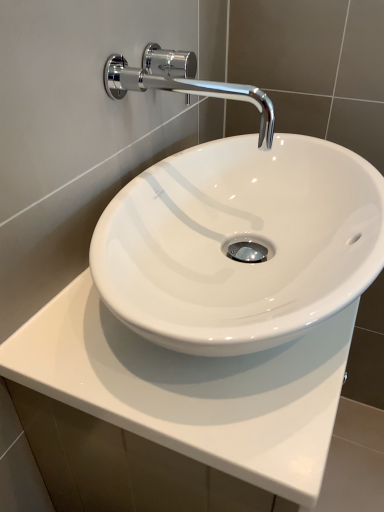
Question: Choose the correct answer: Is white glossy countertop at center inside chrome/metallic faucet at upper center or outside it?

Choices:
 (A) outside
 (B) inside

Answer: (A)

Question: Considering the positions of white glossy countertop at center and chrome/metallic faucet at upper center in the image, is white glossy countertop at center bigger or smaller than chrome/metallic faucet at upper center?

Choices:
 (A) big
 (B) small

Answer: (A)

Question: Would you say white glossy countertop at center is to the left or to the right of chrome/metallic faucet at upper center in the picture?

Choices:
 (A) right
 (B) left

Answer: (A)

Question: Is chrome/metallic faucet at upper center taller or shorter than white glossy countertop at center?

Choices:
 (A) short
 (B) tall

Answer: (A)

Question: Considering their positions, is chrome/metallic faucet at upper center located in front of or behind white glossy countertop at center?

Choices:
 (A) behind
 (B) front

Answer: (A)

Question: From a real-world perspective, is chrome/metallic faucet at upper center physically located above or below white glossy countertop at center?

Choices:
 (A) above
 (B) below

Answer: (A)

Question: Is chrome/metallic faucet at upper center to the left or to the right of white glossy countertop at center in the image?

Choices:
 (A) left
 (B) right

Answer: (A)